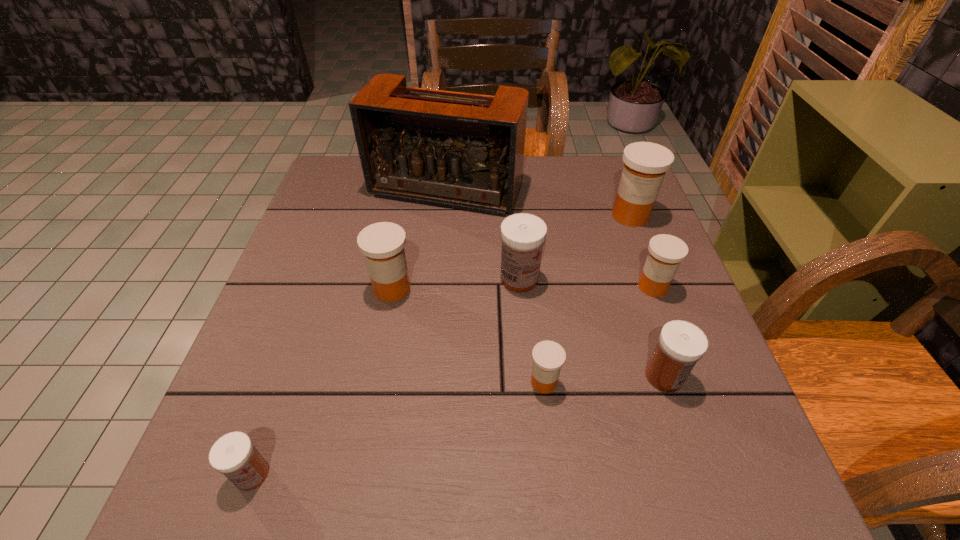
Select which medicine appears as the second closest to the radio receiver. Please provide its 2D coordinates. Your answer should be formatted as a tuple, i.e. [(x, y)], where the tuple contains the x and y coordinates of a point satisfying the conditions above.

[(382, 243)]

Select which medicine appears as the fifth closest to the second medicine from left to right. Please provide its 2D coordinates. Your answer should be formatted as a tuple, i.e. [(x, y)], where the tuple contains the x and y coordinates of a point satisfying the conditions above.

[(666, 252)]

I want to click on orange medicine that stands as the closest to the leftmost medicine, so click(x=382, y=243).

Where is `orange medicine that stands as the second closest to the tallest medicine`? This screenshot has width=960, height=540. orange medicine that stands as the second closest to the tallest medicine is located at coordinates (548, 357).

This screenshot has height=540, width=960. Identify the location of white medicine that is the second nearest to the leftmost object. (681, 344).

Identify which white medicine is the second nearest to the second smallest white medicine. Please provide its 2D coordinates. Your answer should be formatted as a tuple, i.e. [(x, y)], where the tuple contains the x and y coordinates of a point satisfying the conditions above.

[(234, 455)]

This screenshot has height=540, width=960. Find the location of `free location that satisfies the following two spatial constraints: 1. on the label of the second farthest white medicine; 2. on the left side of the third smallest orange medicine`. free location that satisfies the following two spatial constraints: 1. on the label of the second farthest white medicine; 2. on the left side of the third smallest orange medicine is located at coordinates (375, 376).

Locate an element on the screen. free space in the image that satisfies the following two spatial constraints: 1. on the front side of the tallest object; 2. on the right side of the rightmost white medicine is located at coordinates (429, 376).

Identify the location of free location that satisfies the following two spatial constraints: 1. on the label of the farthest orange medicine; 2. on the label of the smallest orange medicine. (694, 382).

This screenshot has width=960, height=540. In order to click on vacant space that satisfies the following two spatial constraints: 1. on the label of the second smallest orange medicine; 2. on the label of the nearest orange medicine in this screenshot , I will do `click(688, 382)`.